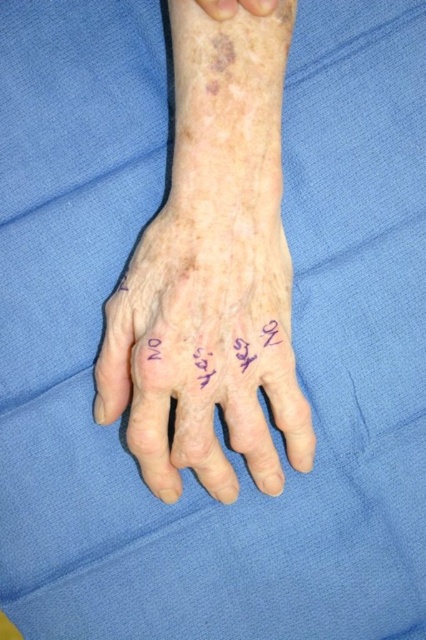
Question: From the image, what is the correct spatial relationship of dry skin hand at center in relation to leather-like skin at upper center?

Choices:
 (A) left
 (B) right

Answer: (A)

Question: Where is dry skin hand at center located in relation to purple ink writing at center in the image?

Choices:
 (A) left
 (B) right

Answer: (A)

Question: Estimate the real-world distances between objects in this image. Which object is closer to the leather-like skin at upper center?

Choices:
 (A) purple ink writing at center
 (B) dry skin hand at center

Answer: (A)

Question: Which point is closer to the camera taking this photo?

Choices:
 (A) (176, 253)
 (B) (186, 342)
 (C) (216, 13)

Answer: (C)

Question: Which is farther from the leather-like skin at upper center?

Choices:
 (A) dry skin hand at center
 (B) purple ink writing at center

Answer: (A)

Question: Is dry skin hand at center closer to camera compared to purple ink writing at center?

Choices:
 (A) yes
 (B) no

Answer: (A)